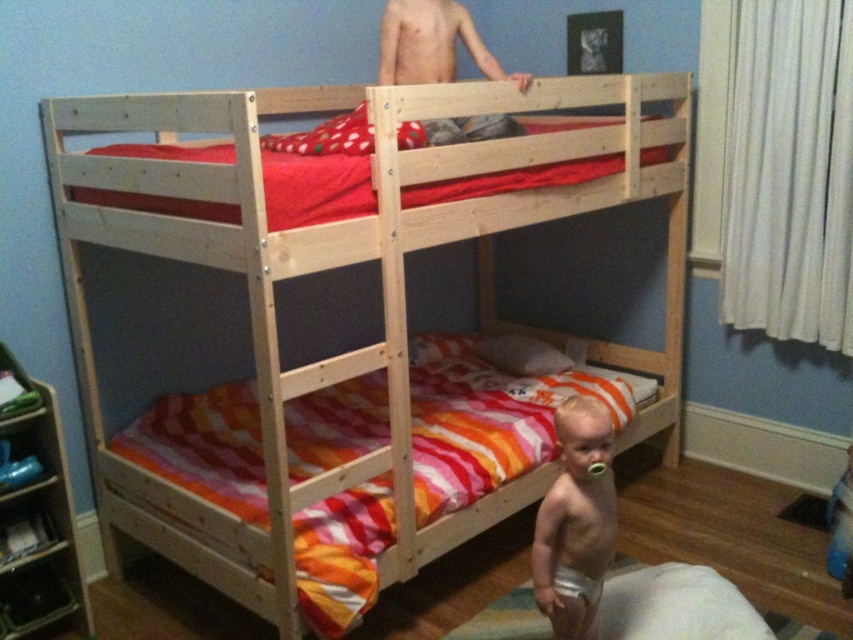
From the picture: Is natural wood bunk bed at center shorter than white cloth diaper at lower center?

No, natural wood bunk bed at center is not shorter than white cloth diaper at lower center.

Image resolution: width=853 pixels, height=640 pixels. I want to click on natural wood bunk bed at center, so click(x=344, y=266).

Who is more forward, (294, 492) or (567, 582)?

Point (294, 492) is more forward.

You are a GUI agent. You are given a task and a screenshot of the screen. Output one action in this format:
    pyautogui.click(x=<x>, y=<y>)
    Task: Click on the natural wood bunk bed at center
    
    Given the screenshot: What is the action you would take?
    pyautogui.click(x=344, y=266)

Can you confirm if skinnysmoothtorso at upper center is bigger than white cloth diaper at lower center?

Yes, skinnysmoothtorso at upper center is bigger than white cloth diaper at lower center.

Between point (386, 12) and point (598, 580), which one is positioned in front?

Point (598, 580) is more forward.

I want to click on skinnysmoothtorso at upper center, so click(x=432, y=44).

Which is behind, point (543, 561) or point (561, 582)?

The point (561, 582) is more distant.

Who is lower down, smooth beige baby at center or white cloth diaper at lower center?

Positioned lower is white cloth diaper at lower center.

Which is in front, point (589, 570) or point (589, 602)?

Point (589, 602) is in front.

Identify the location of smooth beige baby at center. Image resolution: width=853 pixels, height=640 pixels. pyautogui.click(x=575, y=520).